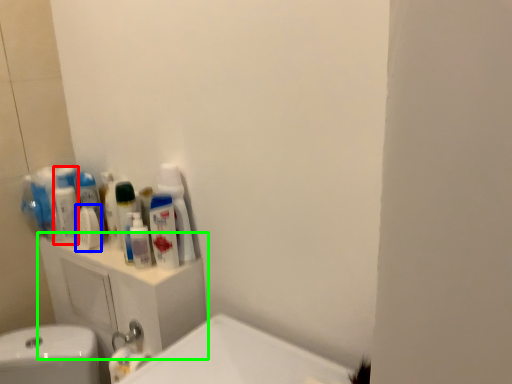
Question: Which is farther away from mouthwash (highlighted by a red box)? mouthwash (highlighted by a blue box) or bathroom cabinet (highlighted by a green box)?

Choices:
 (A) mouthwash
 (B) bathroom cabinet

Answer: (B)